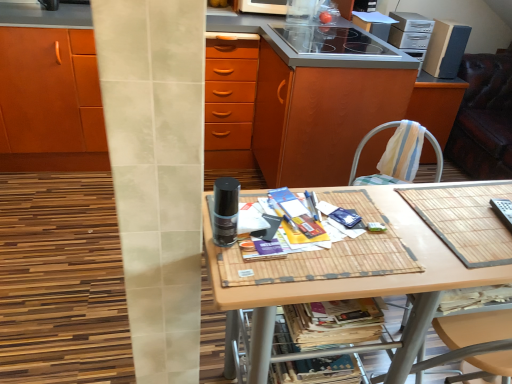
Question: From the image's perspective, is matte wood cabinet at center positioned above or below black glass stove at upper center, which is the 2th appliance in bottom-to-top order?

Choices:
 (A) above
 (B) below

Answer: (B)

Question: Based on their sizes in the image, would you say matte wood cabinet at center is bigger or smaller than black glass stove at upper center, which is the 2th appliance in bottom-to-top order?

Choices:
 (A) small
 (B) big

Answer: (B)

Question: Based on their relative distances, which object is nearer to the matte wood cabinet at center?

Choices:
 (A) wooden at center
 (B) striped fabric chair at right
 (C) black glass stove at upper center, marked as the second appliance in a front-to-back arrangement
 (D) black plastic remote control at right, acting as the first appliance starting from the bottom
 (E) printed paper magazine at lower center, arranged as the 1th magazine when ordered from the bottom

Answer: (A)

Question: Estimate the real-world distances between objects in this image. Which object is closer to the black glass stove at upper center, marked as the second appliance in a front-to-back arrangement?

Choices:
 (A) matte paper magazine at center, the second magazine in the bottom-to-top sequence
 (B) printed paper magazine at lower center, arranged as the 1th magazine when ordered from the bottom
 (C) bamboo mat at center
 (D) cardboard speaker at upper right
 (E) transparent plastic container at upper center, positioned as the third appliance in front-to-back order

Answer: (D)